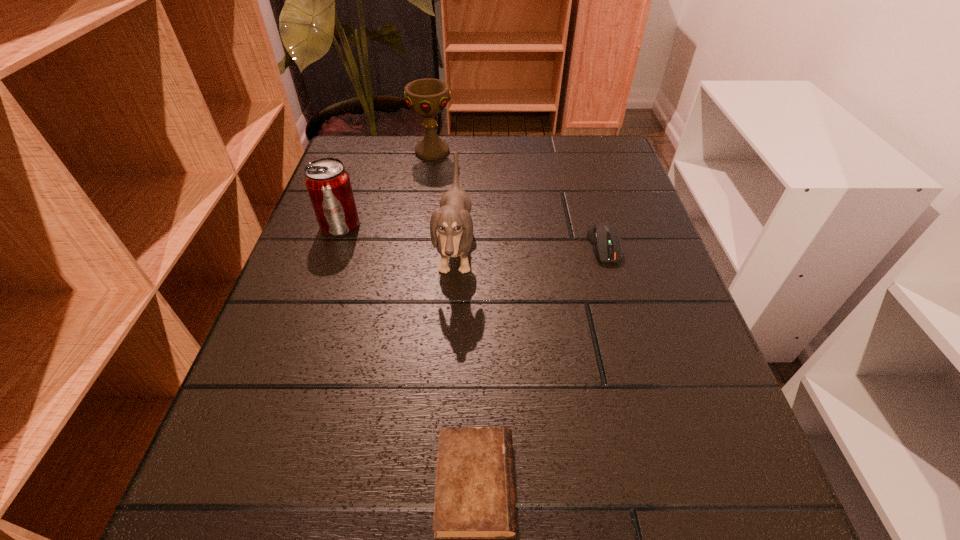
Where is `vacant space at the far right corner of the desktop`? The image size is (960, 540). vacant space at the far right corner of the desktop is located at coordinates (607, 137).

This screenshot has width=960, height=540. I want to click on vacant space that is in between the third tallest object and the chalice, so click(x=386, y=188).

The width and height of the screenshot is (960, 540). I want to click on vacant space that's between the farthest object and the pop soda, so click(x=386, y=188).

The image size is (960, 540). In order to click on free space that is in between the computer equipment and the nearest object in this screenshot , I will do `click(540, 366)`.

Locate an element on the screen. The image size is (960, 540). free space between the puppy and the pop soda is located at coordinates (398, 239).

This screenshot has height=540, width=960. I want to click on vacant region between the leftmost object and the puppy, so click(x=398, y=239).

At what (x,y) coordinates should I click in order to perform the action: click on vacant space that's between the nearest object and the computer equipment. Please return your answer as a coordinate pair (x, y). Looking at the image, I should click on (540, 366).

Identify the location of free point between the diary and the farthest object. The height and width of the screenshot is (540, 960). (454, 318).

The width and height of the screenshot is (960, 540). What are the coordinates of `vacant point located between the rightmost object and the diary` in the screenshot? It's located at (540, 366).

The image size is (960, 540). I want to click on free space between the farthest object and the computer equipment, so click(x=518, y=199).